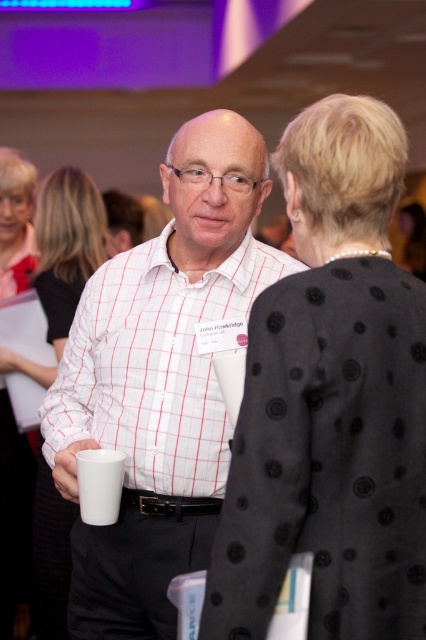
Based on the photo, between black dotted jacket at center and matte white mug at center, which one appears on the left side from the viewer's perspective?

matte white mug at center is more to the left.

Can you confirm if black dotted jacket at center is smaller than matte white mug at center?

Yes.

Is point (417, 417) farther from viewer compared to point (77, 276)?

That is False.

Where is `black dotted jacket at center`? black dotted jacket at center is located at coordinates (331, 401).

Which is below, black dotted jacket at center or white matte mug at lower left?

white matte mug at lower left is lower down.

Is black dotted jacket at center closer to the viewer compared to white matte mug at lower left?

That is True.

Locate an element on the screen. This screenshot has height=640, width=426. black dotted jacket at center is located at coordinates point(331,401).

Can you confirm if matte white mug at center is smaller than white matte mug at lower left?

Incorrect, matte white mug at center is not smaller in size than white matte mug at lower left.

Identify the location of matte white mug at center. (66, 244).